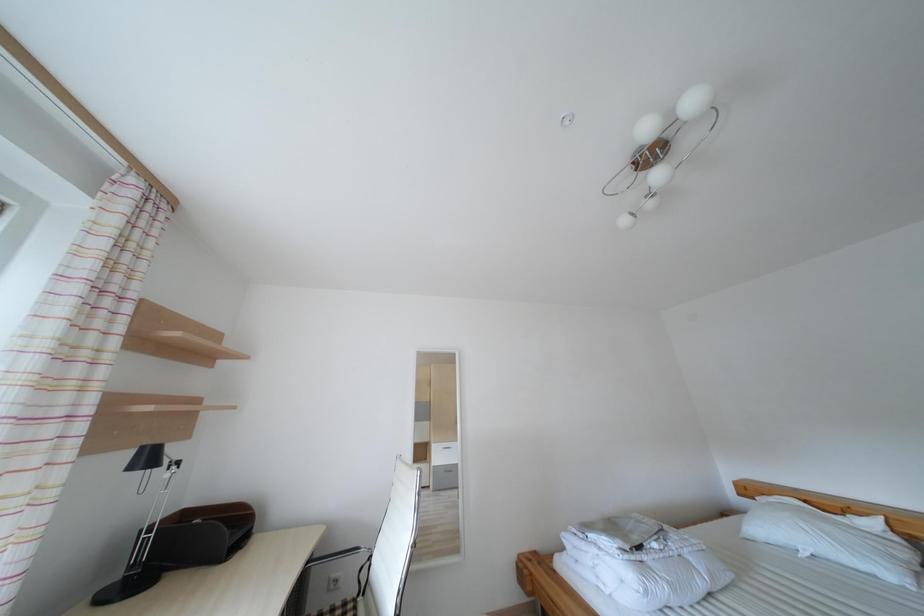
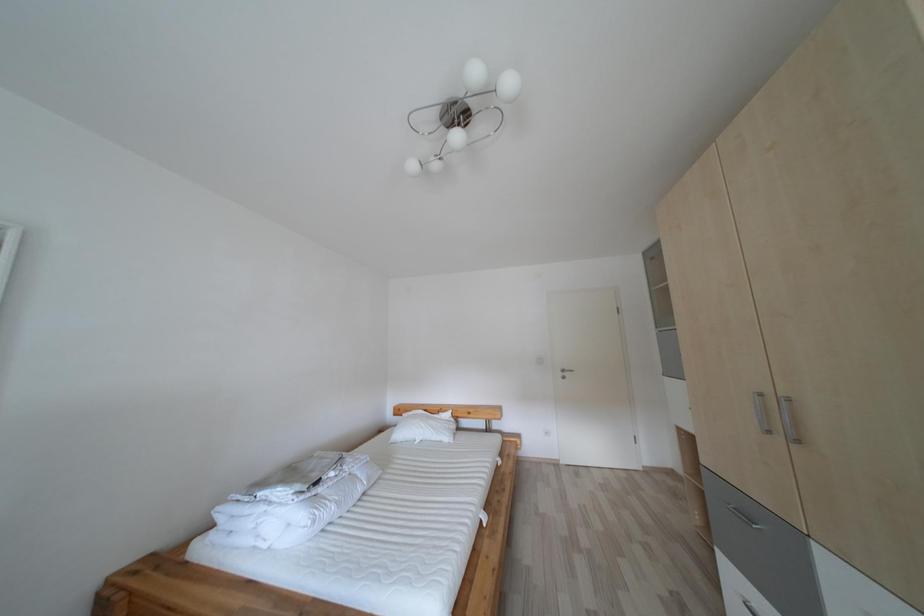
Question: Based on the continuous images, in which direction is the camera rotating? Reply with the corresponding letter.

Choices:
 (A) Left
 (B) Right
 (C) Up
 (D) Down

Answer: (B)